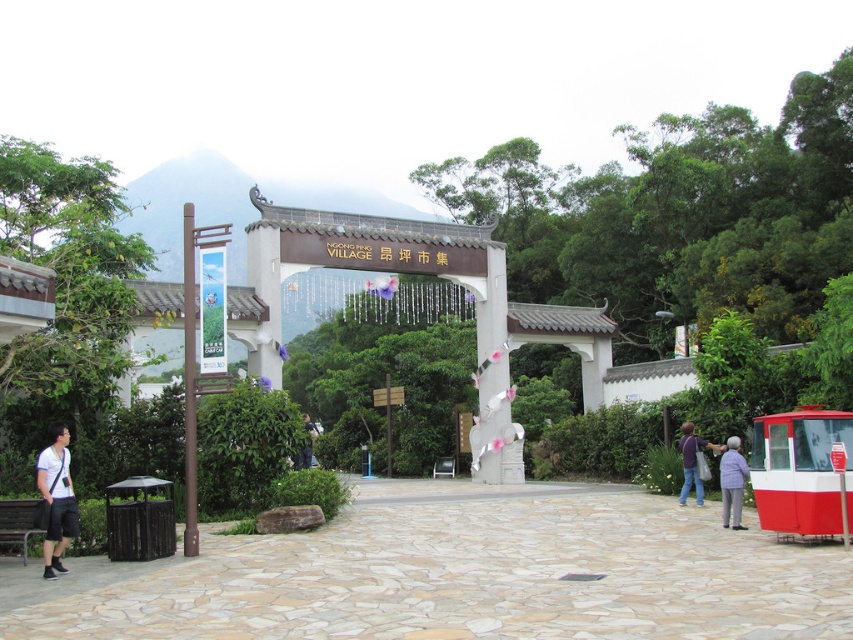
Between white matte shirt at left and dark blue jeans at lower right, which one appears on the left side from the viewer's perspective?

white matte shirt at left is more to the left.

Is point (62, 440) closer to viewer compared to point (683, 488)?

Yes, it is.

This screenshot has width=853, height=640. What are the coordinates of `white matte shirt at left` in the screenshot? It's located at (56, 499).

Consider the image. Who is more distant from viewer, (47, 477) or (309, 445)?

Point (309, 445)

Does point (65, 483) lie in front of point (309, 419)?

That is True.

What do you see at coordinates (56, 499) in the screenshot? I see `white matte shirt at left` at bounding box center [56, 499].

Locate an element on the screen. Image resolution: width=853 pixels, height=640 pixels. white matte shirt at left is located at coordinates (56, 499).

Between white matte shirt at left and gray fabric jacket at lower right, which one appears on the left side from the viewer's perspective?

white matte shirt at left

Who is more distant from viewer, (57, 516) or (724, 456)?

The point (724, 456) is behind.

Where is `white matte shirt at left`? This screenshot has height=640, width=853. white matte shirt at left is located at coordinates (56, 499).